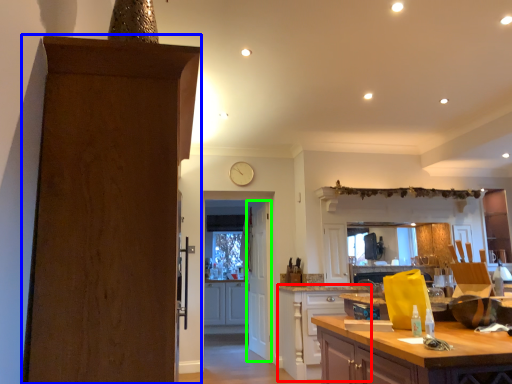
Question: Considering the real-world distances, which object is farthest from cabinetry (highlighted by a red box)? door (highlighted by a blue box) or door (highlighted by a green box)?

Choices:
 (A) door
 (B) door

Answer: (A)